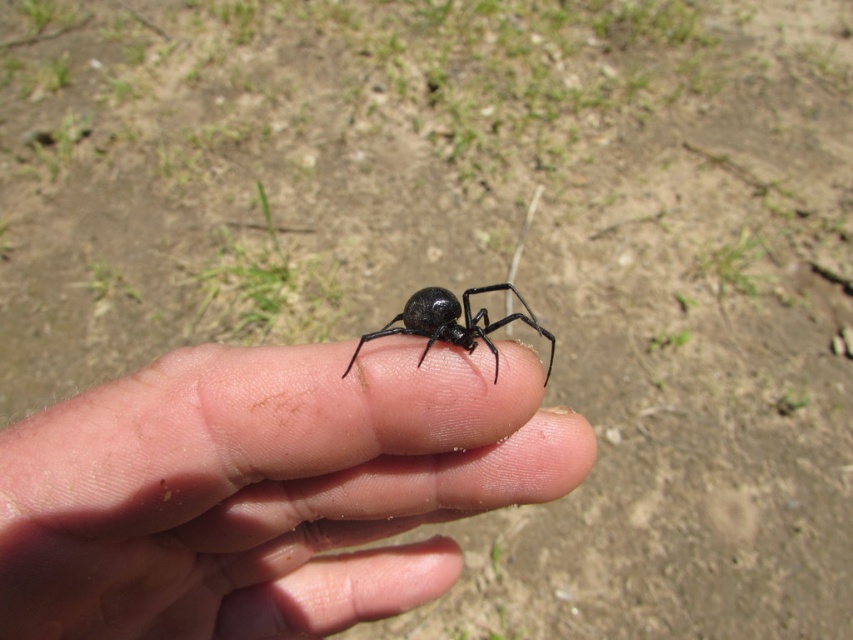
You are a photographer trying to capture a closeup of the spider on the hand. The spider is at point (247, 536). You need to adjust your camera focus to ensure the spider is in sharp focus. What is the minimum distance your camera should be set to focus on to capture the spider clearly?

The point (247, 536) is 18.78 inches away from the camera. Therefore, the camera should be set to focus at least 18.78 inches away to ensure the spider at point (247, 536) is in sharp focus.

You are a photographer trying to capture a closeup of the black matte spider at center. You need to ensure the entire spider fits within the frame. Given that the smooth skin at center is wider than the spider, which object should you focus on to frame the shot properly?

The smooth skin at center is wider than the black matte spider at center, so focusing on the smooth skin at center ensures the entire spider fits within the frame since it is wider.